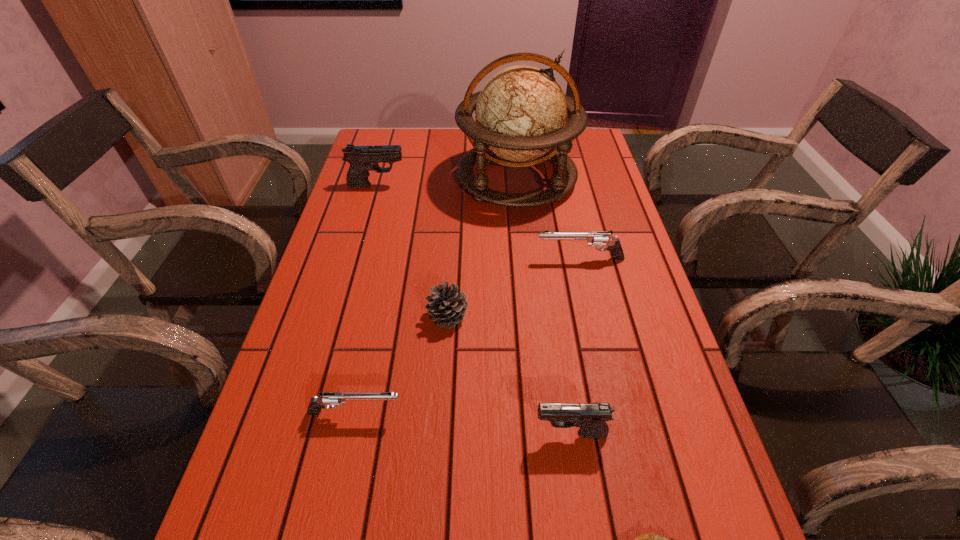
Where is `free space between the smaller black pistol and the farther black pistol`? free space between the smaller black pistol and the farther black pistol is located at coordinates (474, 309).

The height and width of the screenshot is (540, 960). Find the location of `vacant point located between the right black pistol and the third farthest object`. vacant point located between the right black pistol and the third farthest object is located at coordinates (575, 346).

You are a GUI agent. You are given a task and a screenshot of the screen. Output one action in this format:
    pyautogui.click(x=<x>, y=<y>)
    Task: Click on the free area in between the second shortest object and the third farthest object
    Image resolution: width=960 pixels, height=540 pixels.
    Given the screenshot: What is the action you would take?
    pyautogui.click(x=468, y=336)

This screenshot has width=960, height=540. What are the coordinates of `the fifth closest object to the fourth farthest object` in the screenshot? It's located at (650, 539).

Locate an element on the screen. Image resolution: width=960 pixels, height=540 pixels. the sixth closest object to the nearest object is located at coordinates (362, 159).

Locate which pistol ranks fourth in proximity to the tallest object. Please provide its 2D coordinates. Your answer should be formatted as a tuple, i.e. [(x, y)], where the tuple contains the x and y coordinates of a point satisfying the conditions above.

[(591, 418)]

Locate an element on the screen. The image size is (960, 540). pistol object that ranks as the closest to the farther black pistol is located at coordinates [x=594, y=238].

The image size is (960, 540). Find the location of `vacant area in the image that satisfies the following two spatial constraints: 1. on the front side of the tallest object; 2. on the front-facing side of the nearer silver pistol`. vacant area in the image that satisfies the following two spatial constraints: 1. on the front side of the tallest object; 2. on the front-facing side of the nearer silver pistol is located at coordinates (540, 413).

Locate an element on the screen. This screenshot has width=960, height=540. free location that satisfies the following two spatial constraints: 1. at the barrel of the farthest pistol; 2. on the back side of the pinecone is located at coordinates (340, 316).